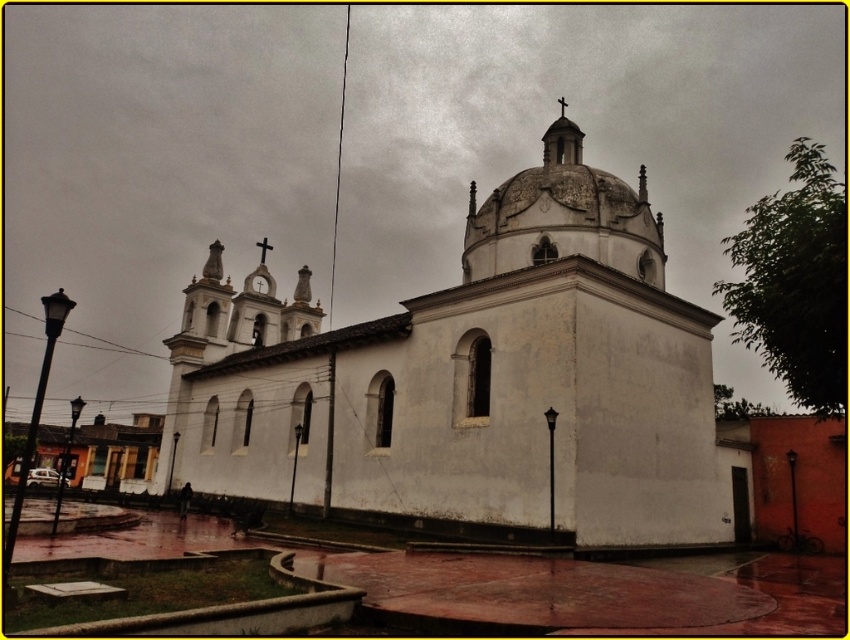
You are a photographer standing in front of the church. You want to capture a photo that includes both the white matte church at center and the white stone dome at upper center. Based on their positions, which object should appear lower in the photo?

The white matte church at center appears lower in the photo because it is located below the white stone dome at upper center.